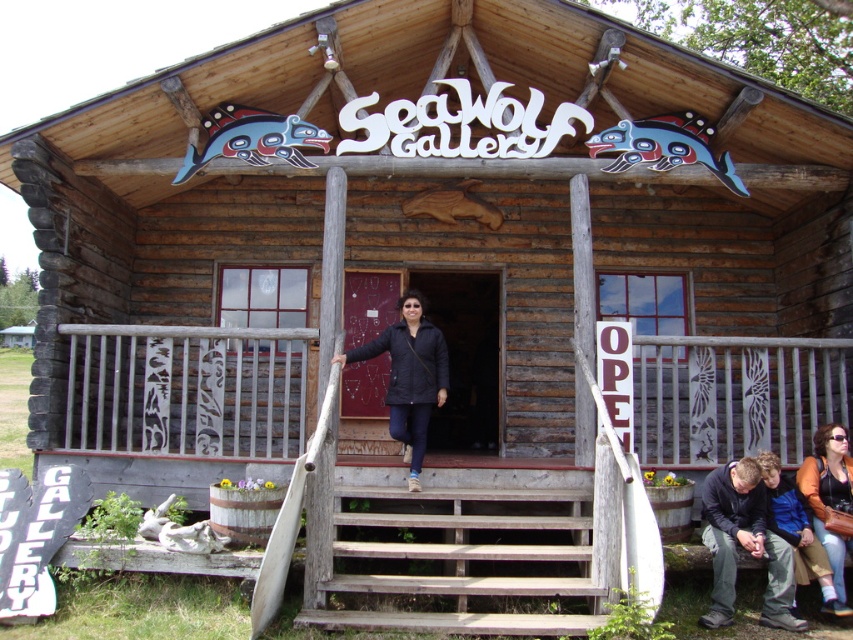
Is dark blue jacket at lower right bigger than orange fabric jacket at center?

Yes, dark blue jacket at lower right is bigger than orange fabric jacket at center.

This screenshot has height=640, width=853. Describe the element at coordinates (744, 545) in the screenshot. I see `dark blue jacket at lower right` at that location.

Identify the location of dark blue jacket at lower right. (744, 545).

Can you confirm if weathered wood stairs at center is smaller than dark blue jacket at lower right?

Result: Actually, weathered wood stairs at center might be larger than dark blue jacket at lower right.

Can you confirm if weathered wood stairs at center is positioned below dark blue jacket at lower right?

Indeed, weathered wood stairs at center is positioned under dark blue jacket at lower right.

Does point (448, 493) come in front of point (780, 547)?

No.

Where is `weathered wood stairs at center`? This screenshot has height=640, width=853. weathered wood stairs at center is located at coordinates (460, 563).

Between weathered wood stairs at center and black matte jacket at center, which one is positioned lower?

weathered wood stairs at center is below.

Which of these two, weathered wood stairs at center or black matte jacket at center, stands shorter?

With less height is weathered wood stairs at center.

Who is more forward, (515,566) or (424,321)?

Point (515,566)

Find the location of `weathered wood stairs at center`. weathered wood stairs at center is located at coordinates (460, 563).